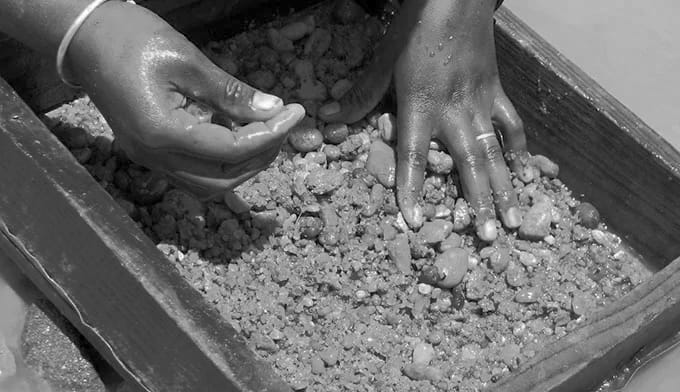
You are a GUI agent. You are given a task and a screenshot of the screen. Output one action in this format:
    pyautogui.click(x=<x>, y=<y>)
    Task: Click on the wooden boards
    The image size is (680, 392).
    Given the screenshot: What is the action you would take?
    pyautogui.click(x=593, y=120), pyautogui.click(x=612, y=340), pyautogui.click(x=103, y=276), pyautogui.click(x=51, y=78)